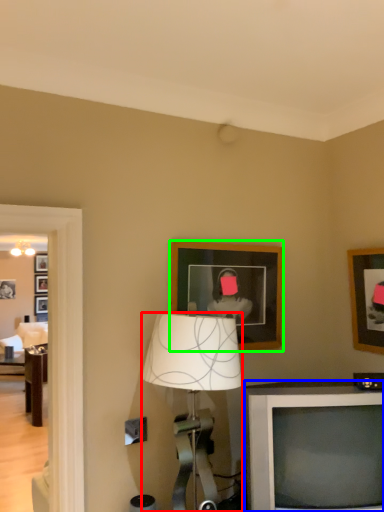
Question: Estimate the real-world distances between objects in this image. Which object is farther from lamp (highlighted by a red box), television (highlighted by a blue box) or picture frame (highlighted by a green box)?

Choices:
 (A) television
 (B) picture frame

Answer: (B)